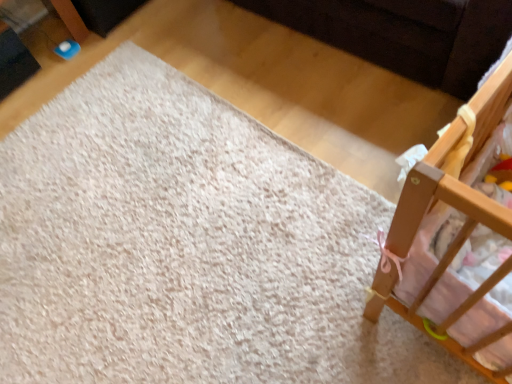
Question: Is wooden crib at right behind white soft carpet at upper left?

Choices:
 (A) yes
 (B) no

Answer: (B)

Question: From the image's perspective, would you say wooden crib at right is positioned over white soft carpet at upper left?

Choices:
 (A) no
 (B) yes

Answer: (B)

Question: Is wooden crib at right oriented towards white soft carpet at upper left?

Choices:
 (A) yes
 (B) no

Answer: (B)

Question: Considering the relative sizes of wooden crib at right and white soft carpet at upper left in the image provided, is wooden crib at right bigger than white soft carpet at upper left?

Choices:
 (A) yes
 (B) no

Answer: (A)

Question: Is wooden crib at right looking in the opposite direction of white soft carpet at upper left?

Choices:
 (A) no
 (B) yes

Answer: (A)

Question: Is wooden crib at right to the left of white soft carpet at upper left from the viewer's perspective?

Choices:
 (A) no
 (B) yes

Answer: (A)

Question: From the image's perspective, does white soft carpet at upper left appear lower than wooden crib at right?

Choices:
 (A) yes
 (B) no

Answer: (A)

Question: Is wooden crib at right at the back of white soft carpet at upper left?

Choices:
 (A) yes
 (B) no

Answer: (B)

Question: Can you confirm if white soft carpet at upper left is bigger than wooden crib at right?

Choices:
 (A) no
 (B) yes

Answer: (A)

Question: Is there a large distance between white soft carpet at upper left and wooden crib at right?

Choices:
 (A) yes
 (B) no

Answer: (B)

Question: From the image's perspective, is white soft carpet at upper left located above wooden crib at right?

Choices:
 (A) yes
 (B) no

Answer: (B)

Question: Is white soft carpet at upper left at the right side of wooden crib at right?

Choices:
 (A) no
 (B) yes

Answer: (A)

Question: Based on their sizes in the image, would you say wooden crib at right is bigger or smaller than white soft carpet at upper left?

Choices:
 (A) small
 (B) big

Answer: (B)